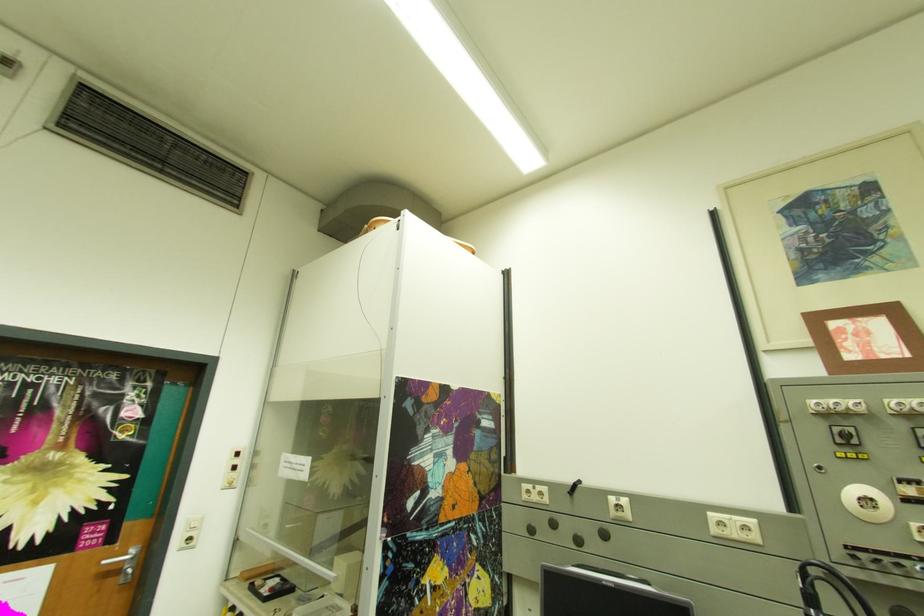
At what (x,y) coordinates should I click in order to perform the action: click on large white dial. Please return your answer as a coordinate pair (x, y). The width and height of the screenshot is (924, 616). Looking at the image, I should click on (868, 503).